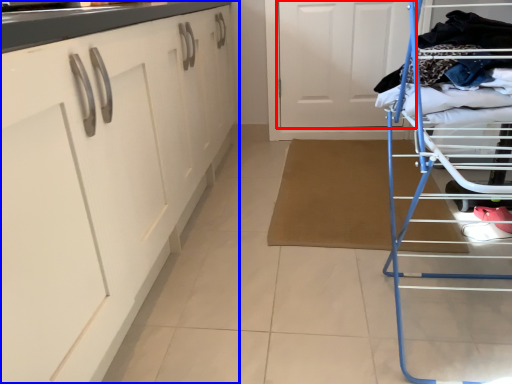
Question: Among these objects, which one is nearest to the camera, door (highlighted by a red box) or cabinetry (highlighted by a blue box)?

Choices:
 (A) door
 (B) cabinetry

Answer: (B)